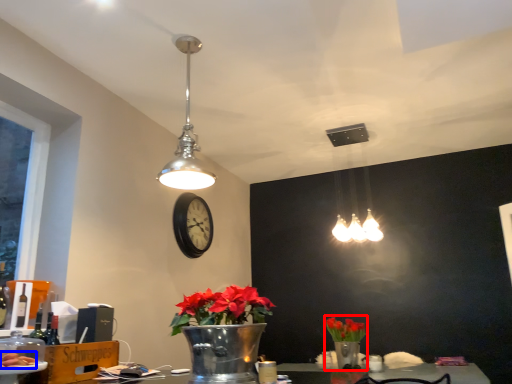
Question: Which object appears farthest to the camera in this image, floral arrangement (highlighted by a red box) or food (highlighted by a blue box)?

Choices:
 (A) floral arrangement
 (B) food

Answer: (A)